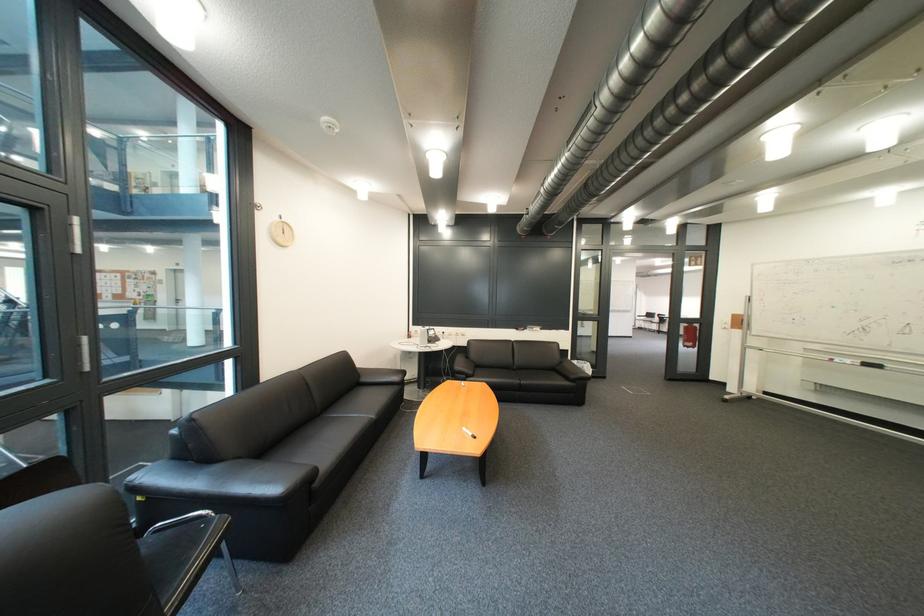
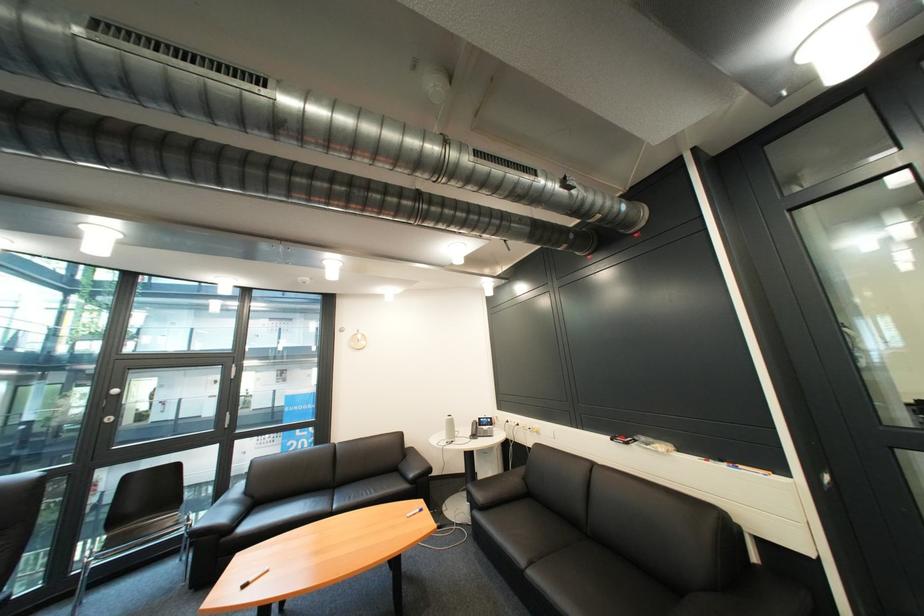
Question: I am providing you with two images of the same scene from different viewpoints. Which of the following objects are not visible in image2?

Choices:
 (A) white water bottle
 (B) black sofa armrest
 (C) grey conference phone
 (D) none of these

Answer: (D)